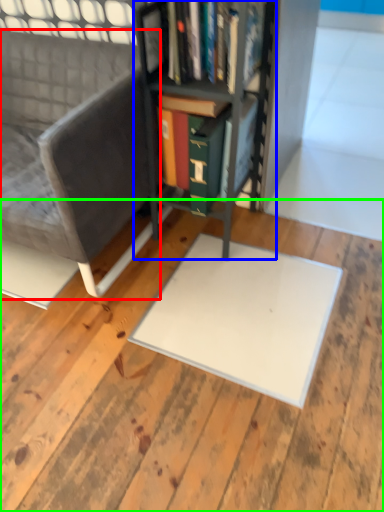
Question: Considering the real-world distances, which object is closest to chair (highlighted by a red box)? bookcase (highlighted by a blue box) or plywood (highlighted by a green box).

Choices:
 (A) bookcase
 (B) plywood

Answer: (A)